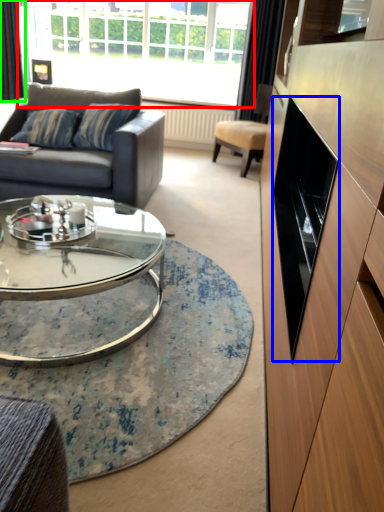
Question: Considering the real-world distances, which object is closest to window (highlighted by a red box)? drawer (highlighted by a blue box) or curtain (highlighted by a green box).

Choices:
 (A) drawer
 (B) curtain

Answer: (B)